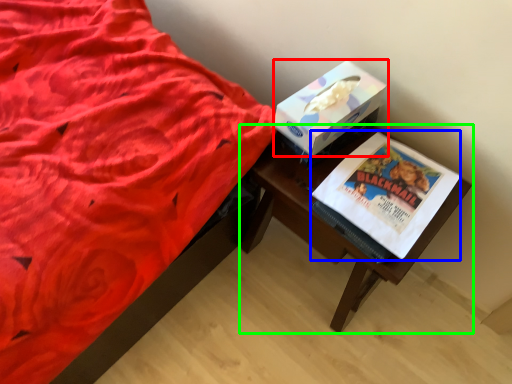
Question: Which object is the farthest from box (highlighted by a red box)? Choose among these: paperback book (highlighted by a blue box) or table (highlighted by a green box).

Choices:
 (A) paperback book
 (B) table

Answer: (B)